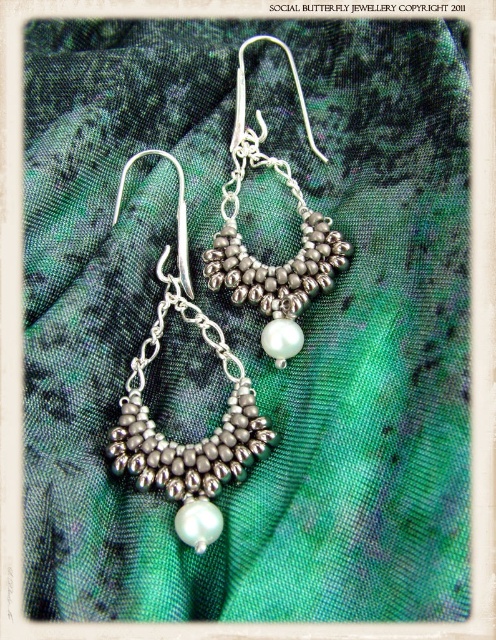
Does silver metallic beads at center come behind silver metallic beaded hoop at center?

No, it is not.

Can you confirm if silver metallic beads at center is positioned to the left of silver metallic beaded hoop at center?

Indeed, silver metallic beads at center is positioned on the left side of silver metallic beaded hoop at center.

Between point (218, 486) and point (238, 84), which one is positioned behind?

Positioned behind is point (238, 84).

Where is `silver metallic beads at center`? Image resolution: width=496 pixels, height=640 pixels. silver metallic beads at center is located at coordinates (202, 438).